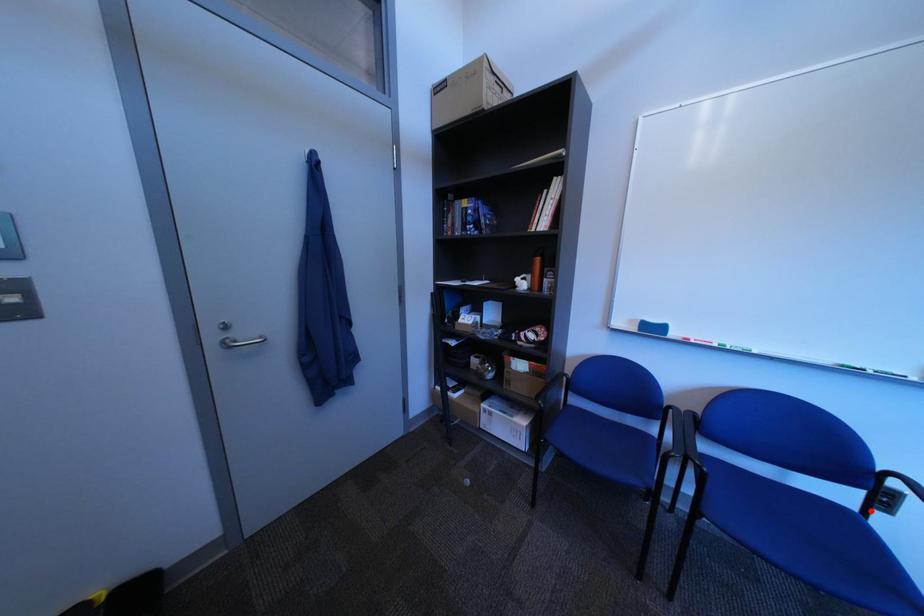
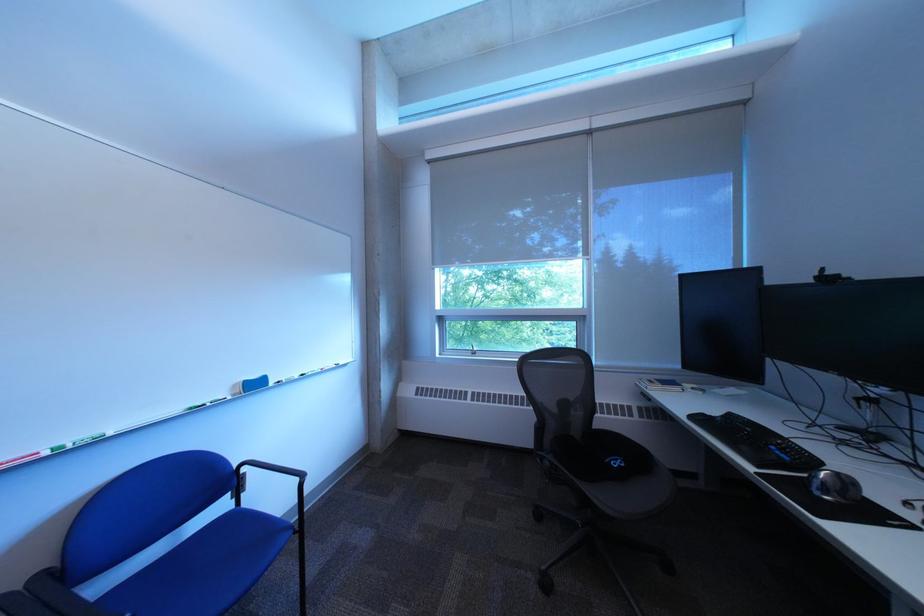
The point at the highlighted location is marked in the first image. Where is the corresponding point in the second image?

(248, 508)